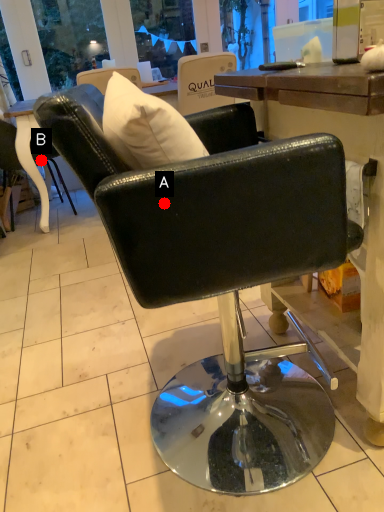
Question: Two points are circled on the image, labeled by A and B beside each circle. Which of the following is the closest to the observer?

Choices:
 (A) A is closer
 (B) B is closer

Answer: (A)